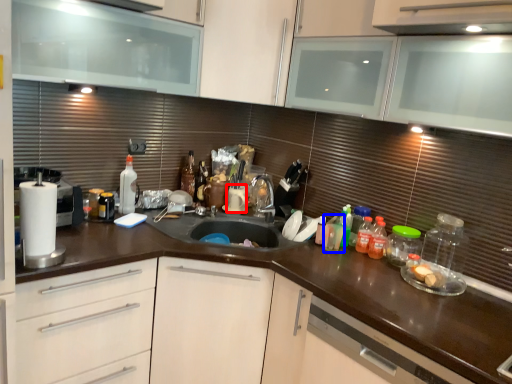
Question: Among these objects, which one is farthest to the camera, appliance (highlighted by a red box) or bottle (highlighted by a blue box)?

Choices:
 (A) appliance
 (B) bottle

Answer: (A)